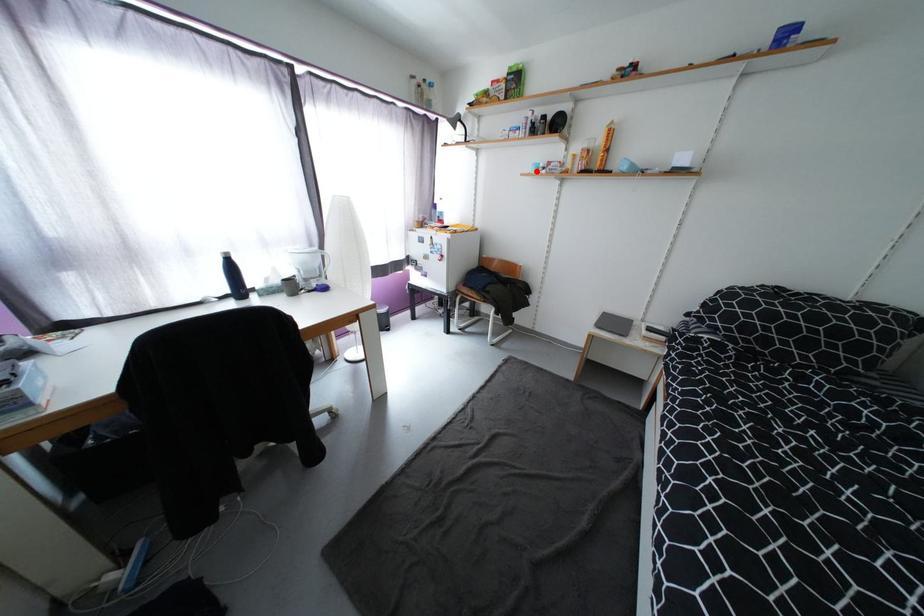
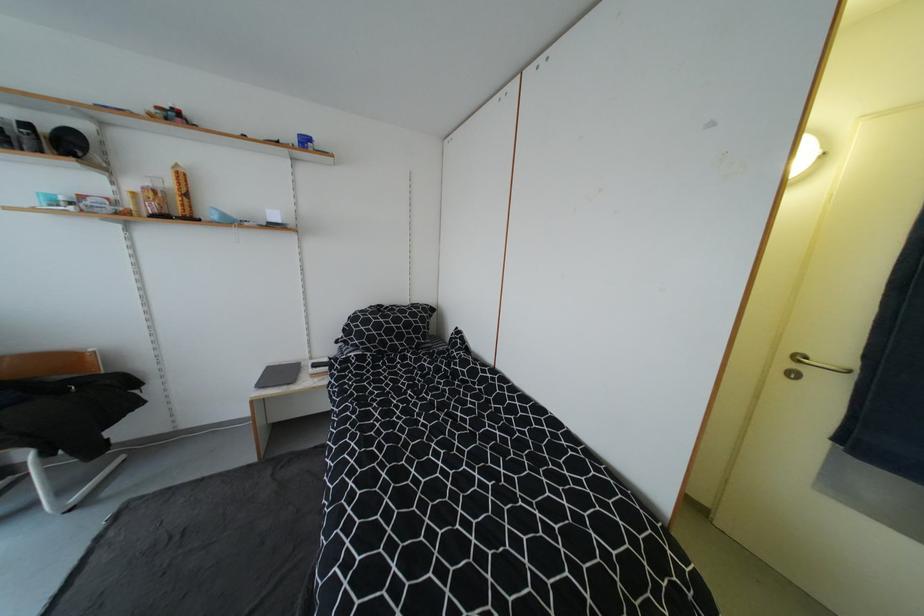
Locate, in the second image, the point that corresponds to the highlighted location in the first image.

(43, 204)